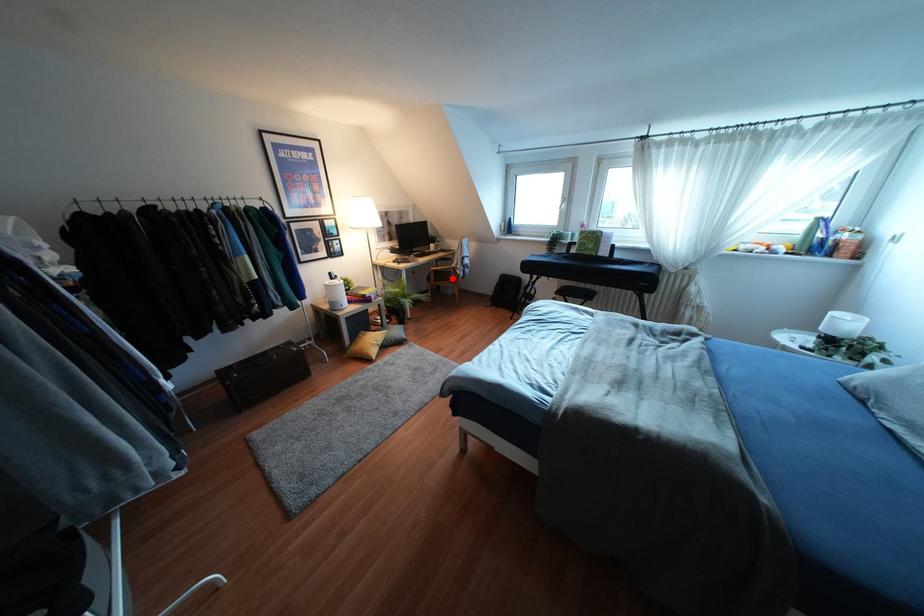
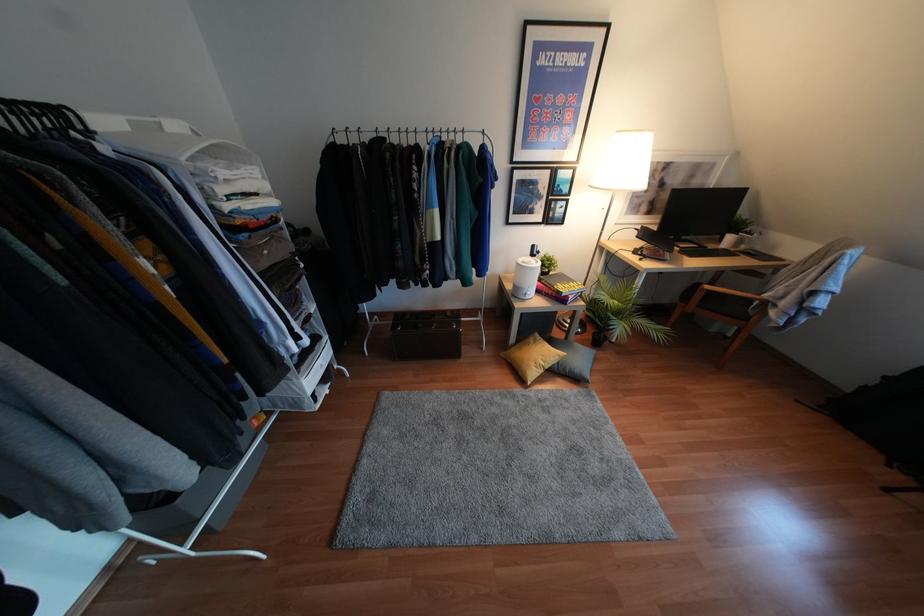
Question: A red point is marked in image1. In image2, is the corresponding 3D point closer to the camera or farther? Reply with the corresponding letter.

Choices:
 (A) The corresponding 3D point is closer.
 (B) The corresponding 3D point is farther.

Answer: (B)